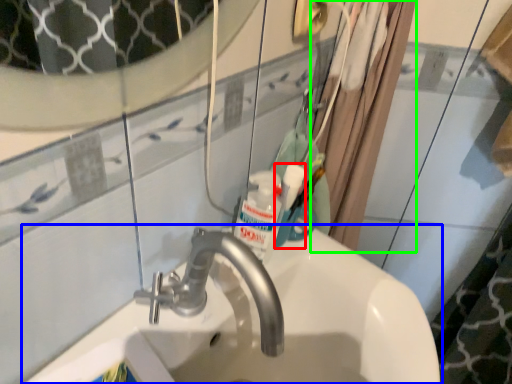
Question: Which is nearer to the mouthwash (highlighted by a red box)? sink (highlighted by a blue box) or shower curtain (highlighted by a green box).

Choices:
 (A) sink
 (B) shower curtain

Answer: (A)